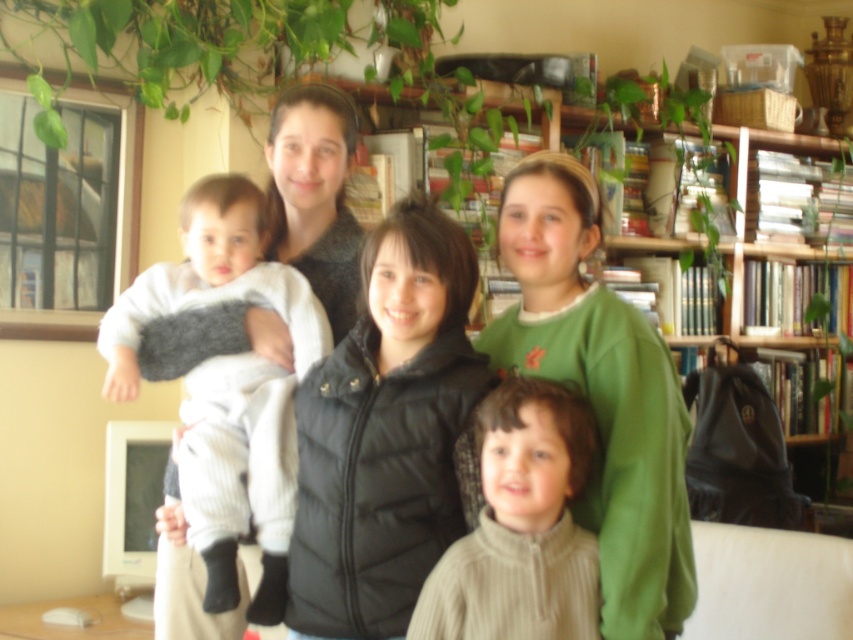
Looking at this image, which of these two, black puffer vest at center or tan ribbed sweater at center, stands shorter?

tan ribbed sweater at center is shorter.

Describe the element at coordinates (386, 433) in the screenshot. Image resolution: width=853 pixels, height=640 pixels. I see `black puffer vest at center` at that location.

Is point (347, 547) positioned in front of point (506, 387)?

Yes.

The image size is (853, 640). I want to click on black puffer vest at center, so click(x=386, y=433).

Does black puffer vest at center appear on the left side of white soft fabric baby at left?

No, black puffer vest at center is not to the left of white soft fabric baby at left.

This screenshot has height=640, width=853. What do you see at coordinates (386, 433) in the screenshot?
I see `black puffer vest at center` at bounding box center [386, 433].

Between point (376, 522) and point (256, 621), which one is positioned in front?

Point (376, 522) is in front.

At what (x,y) coordinates should I click in order to perform the action: click on black puffer vest at center. Please return your answer as a coordinate pair (x, y). The image size is (853, 640). Looking at the image, I should click on (386, 433).

Can you confirm if black puffer vest at center is positioned above wooden bookshelf at upper center?

Yes, black puffer vest at center is above wooden bookshelf at upper center.

Looking at this image, does black puffer vest at center appear on the right side of wooden bookshelf at upper center?

Incorrect, black puffer vest at center is not on the right side of wooden bookshelf at upper center.

The image size is (853, 640). What do you see at coordinates (386, 433) in the screenshot?
I see `black puffer vest at center` at bounding box center [386, 433].

This screenshot has width=853, height=640. Find the location of `black puffer vest at center`. black puffer vest at center is located at coordinates (386, 433).